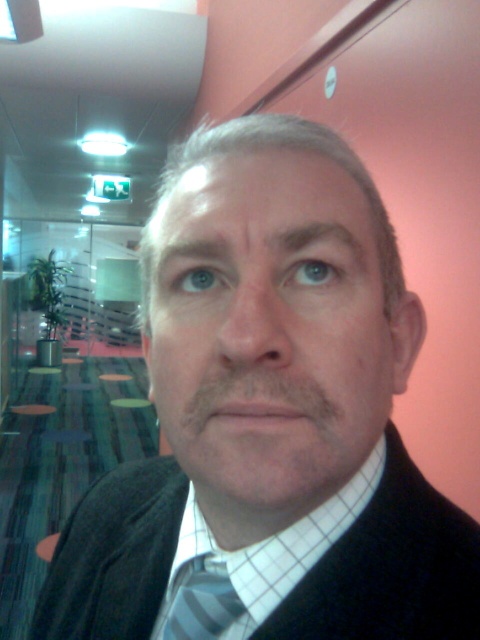
You are a GUI agent. You are given a task and a screenshot of the screen. Output one action in this format:
    pyautogui.click(x=<x>, y=<y>)
    Task: Click on the white checkered dress shirt at center
    
    Given the screenshot: What is the action you would take?
    pyautogui.click(x=253, y=563)

Does white checkered dress shirt at center have a lesser height compared to striped fabric tie at center?

No, white checkered dress shirt at center is not shorter than striped fabric tie at center.

Who is more forward, (210,547) or (217,602)?

Point (217,602) is in front.

This screenshot has height=640, width=480. Identify the location of white checkered dress shirt at center. (253, 563).

Between matte black face at center and white checkered dress shirt at center, which one has less height?

white checkered dress shirt at center

Is matte black face at center to the right of white checkered dress shirt at center from the viewer's perspective?

Correct, you'll find matte black face at center to the right of white checkered dress shirt at center.

This screenshot has height=640, width=480. In order to click on matte black face at center in this screenshot , I will do `click(268, 332)`.

Does matte black face at center come in front of striped fabric tie at center?

Yes.

Does matte black face at center appear over striped fabric tie at center?

Yes, matte black face at center is above striped fabric tie at center.

Between point (308, 435) and point (187, 572), which one is positioned in front?

Point (308, 435) is in front.

Locate an element on the screen. This screenshot has width=480, height=640. matte black face at center is located at coordinates click(268, 332).